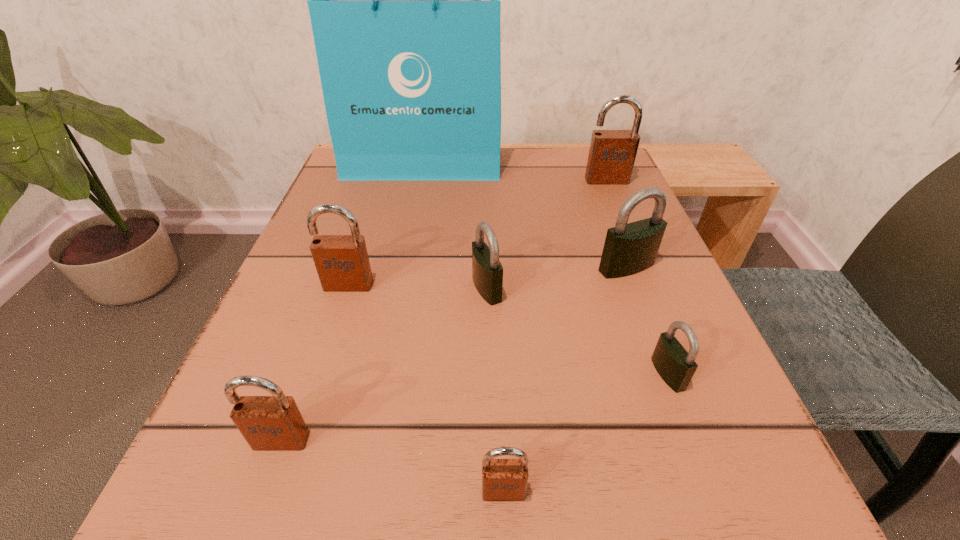
Where is `shopping bag`? This screenshot has width=960, height=540. shopping bag is located at coordinates (404, 0).

At what (x,y) coordinates should I click in order to perform the action: click on blue shopping bag. Please return your answer as a coordinate pair (x, y). The width and height of the screenshot is (960, 540). Looking at the image, I should click on (404, 0).

I want to click on the farthest brown padlock, so click(x=612, y=153).

Where is `the tallest padlock`? Image resolution: width=960 pixels, height=540 pixels. the tallest padlock is located at coordinates (612, 153).

This screenshot has height=540, width=960. I want to click on the biggest black padlock, so click(631, 248).

The width and height of the screenshot is (960, 540). I want to click on the second biggest brown padlock, so click(342, 263).

You are a GUI agent. You are given a task and a screenshot of the screen. Output one action in this format:
    pyautogui.click(x=<x>, y=<y>)
    Task: Click on the leftmost black padlock
    
    Given the screenshot: What is the action you would take?
    point(487,271)

Where is `the second nearest brown padlock`? the second nearest brown padlock is located at coordinates (268, 423).

Image resolution: width=960 pixels, height=540 pixels. I want to click on the second smallest brown padlock, so click(x=268, y=423).

The height and width of the screenshot is (540, 960). I want to click on the smallest black padlock, so 676,366.